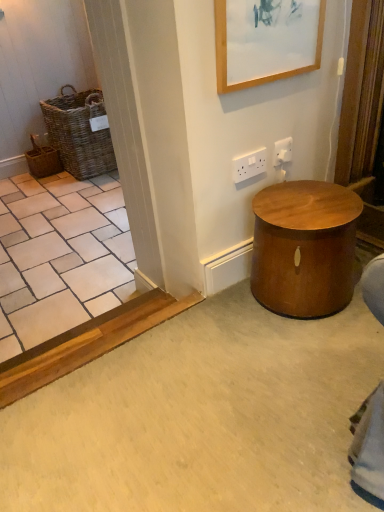
Question: Is wooden picture frame at upper center oriented towards woven brown basket at left, positioned as the 1th basket in right-to-left order?

Choices:
 (A) no
 (B) yes

Answer: (A)

Question: Can you confirm if wooden picture frame at upper center is thinner than woven brown basket at left, the second basket positioned from the left?

Choices:
 (A) yes
 (B) no

Answer: (A)

Question: Is wooden picture frame at upper center to the left of woven brown basket at left, the second basket positioned from the left, from the viewer's perspective?

Choices:
 (A) no
 (B) yes

Answer: (A)

Question: From a real-world perspective, is wooden picture frame at upper center on woven brown basket at left, the second basket positioned from the left?

Choices:
 (A) no
 (B) yes

Answer: (B)

Question: Does wooden picture frame at upper center have a smaller size compared to woven brown basket at left, positioned as the 1th basket in right-to-left order?

Choices:
 (A) yes
 (B) no

Answer: (A)

Question: Based on their sizes in the image, would you say white plastic electric outlet at upper right, the second electric outlet in the left-to-right sequence, is bigger or smaller than white plastic electric outlet at upper center, marked as the second electric outlet in a right-to-left arrangement?

Choices:
 (A) big
 (B) small

Answer: (B)

Question: Which is correct: white plastic electric outlet at upper right, the second electric outlet in the left-to-right sequence, is inside white plastic electric outlet at upper center, marked as the second electric outlet in a right-to-left arrangement, or outside of it?

Choices:
 (A) inside
 (B) outside

Answer: (B)

Question: From the image's perspective, is white plastic electric outlet at upper right, acting as the 1th electric outlet starting from the right, positioned above or below white plastic electric outlet at upper center, placed as the 1th electric outlet when sorted from left to right?

Choices:
 (A) below
 (B) above

Answer: (B)

Question: Relative to white plastic electric outlet at upper center, marked as the second electric outlet in a right-to-left arrangement, is white plastic electric outlet at upper right, acting as the 1th electric outlet starting from the right, in front or behind?

Choices:
 (A) behind
 (B) front

Answer: (A)

Question: From their relative heights in the image, would you say woven brown basket at left, positioned as the 1th basket in right-to-left order, is taller or shorter than white plastic electric outlet at upper right, the second electric outlet in the left-to-right sequence?

Choices:
 (A) tall
 (B) short

Answer: (A)

Question: Choose the correct answer: Is woven brown basket at left, positioned as the 1th basket in right-to-left order, inside white plastic electric outlet at upper right, acting as the 1th electric outlet starting from the right, or outside it?

Choices:
 (A) outside
 (B) inside

Answer: (A)

Question: In the image, is woven brown basket at left, the second basket positioned from the left, on the left side or the right side of white plastic electric outlet at upper right, the second electric outlet in the left-to-right sequence?

Choices:
 (A) left
 (B) right

Answer: (A)

Question: From the image's perspective, relative to white plastic electric outlet at upper right, the second electric outlet in the left-to-right sequence, is woven brown basket at left, the second basket positioned from the left, above or below?

Choices:
 (A) below
 (B) above

Answer: (B)

Question: Relative to wooden picture frame at upper center, is woven brown basket at left, arranged as the 2th basket when viewed from the right, in front or behind?

Choices:
 (A) behind
 (B) front

Answer: (A)

Question: Is woven brown basket at left, arranged as the 2th basket when viewed from the right, wider or thinner than wooden picture frame at upper center?

Choices:
 (A) thin
 (B) wide

Answer: (B)